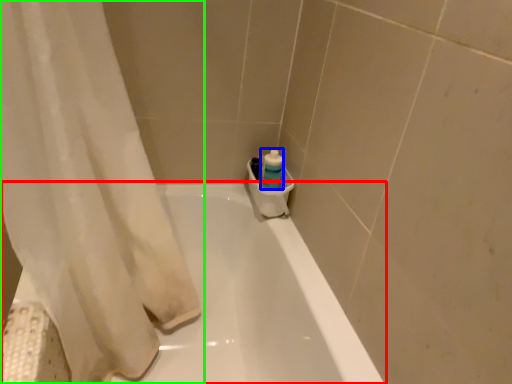
Question: Which object is positioned closest to bathtub (highlighted by a red box)? Select from cleaning product (highlighted by a blue box) and curtain (highlighted by a green box).

Choices:
 (A) cleaning product
 (B) curtain

Answer: (B)